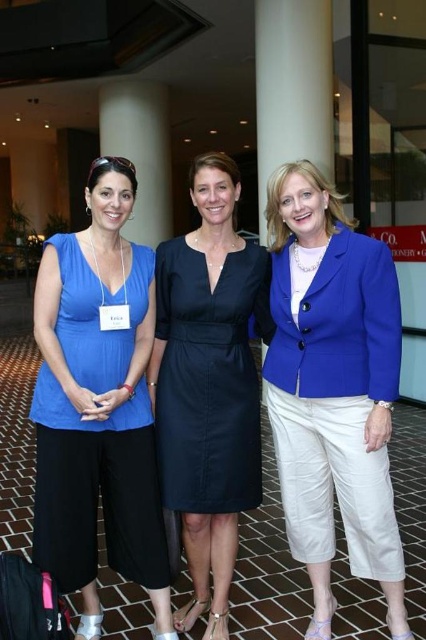
Question: Which object is closer to the camera taking this photo?

Choices:
 (A) white glossy pillar at upper center
 (B) navy satin dress at center
 (C) matte blue top at center
 (D) matte blue blazer at center

Answer: (D)

Question: Does matte blue top at center appear on the left side of white glossy pillar at upper center?

Choices:
 (A) no
 (B) yes

Answer: (A)

Question: Which object is farther from the camera taking this photo?

Choices:
 (A) matte blue top at center
 (B) navy satin dress at center

Answer: (B)

Question: Considering the relative positions of navy satin dress at center and white glossy pillar at upper center in the image provided, where is navy satin dress at center located with respect to white glossy pillar at upper center?

Choices:
 (A) right
 (B) left

Answer: (A)

Question: Which point is closer to the camera?

Choices:
 (A) (226, 300)
 (B) (146, 198)
 (C) (313, 429)
 (D) (39, 333)

Answer: (D)

Question: Is matte blue top at center positioned behind navy satin dress at center?

Choices:
 (A) yes
 (B) no

Answer: (B)